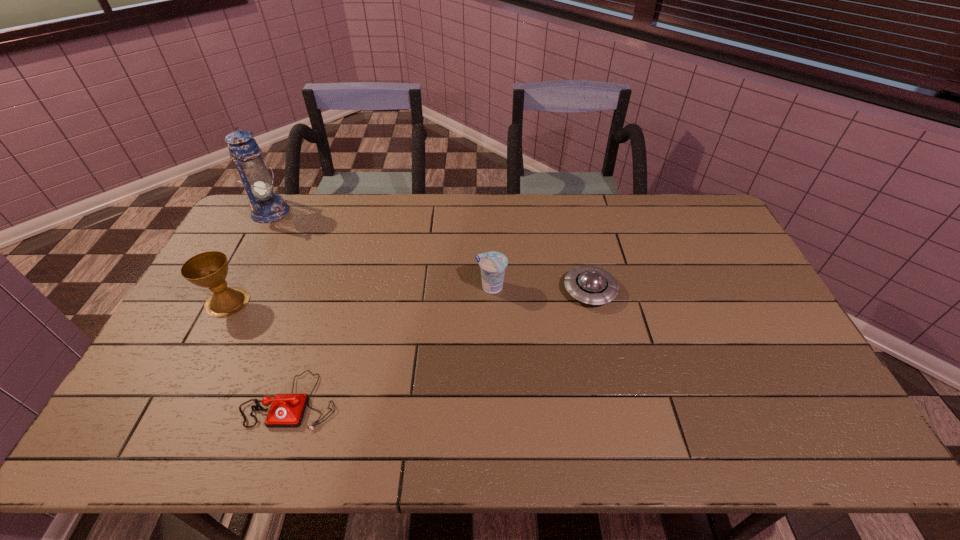
Where is `vacant area situated on the left of the yogurt`? vacant area situated on the left of the yogurt is located at coordinates (426, 287).

Locate an element on the screen. The width and height of the screenshot is (960, 540). vacant area situated 0.070m on the left of the rightmost object is located at coordinates (540, 291).

Identify the location of object located in the far edge section of the desktop. This screenshot has height=540, width=960. (266, 206).

Find the location of a particular element. object that is at the near edge is located at coordinates (287, 410).

Find the location of `lantern at the left edge`. lantern at the left edge is located at coordinates (266, 206).

In order to click on chalice located in the left edge section of the desktop in this screenshot , I will do `click(209, 269)`.

Image resolution: width=960 pixels, height=540 pixels. In order to click on object that is positioned at the far left corner in this screenshot , I will do (266, 206).

Locate an element on the screen. This screenshot has width=960, height=540. vacant space at the far edge of the desktop is located at coordinates (375, 234).

At what (x,y) coordinates should I click in order to perform the action: click on free region at the near edge of the desktop. Please return your answer as a coordinate pair (x, y). This screenshot has height=540, width=960. Looking at the image, I should click on (611, 424).

At what (x,y) coordinates should I click in order to perform the action: click on vacant space at the near left corner. Please return your answer as a coordinate pair (x, y). This screenshot has height=540, width=960. Looking at the image, I should click on (146, 421).